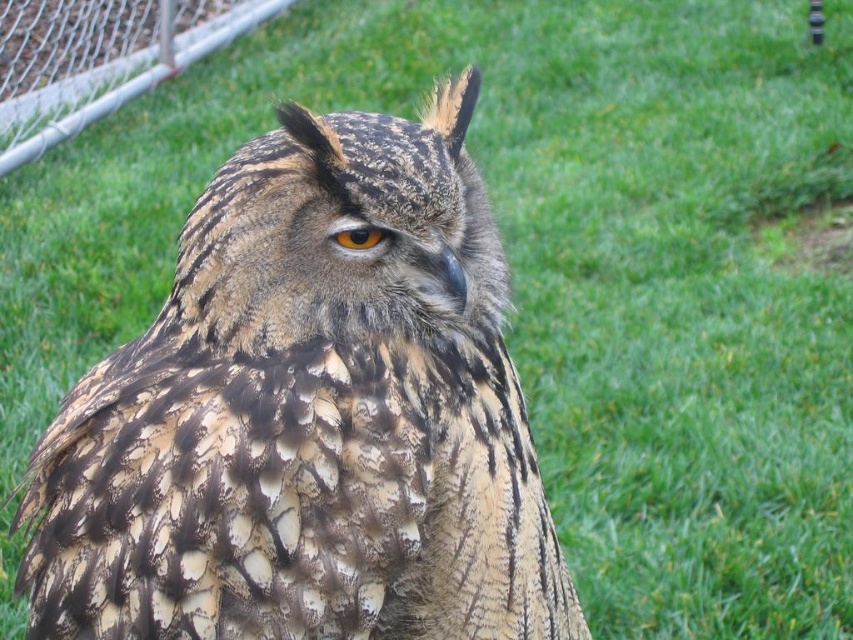
Question: Observing the image, what is the correct spatial positioning of brushed metal fence at upper left in reference to brown textured eye at center?

Choices:
 (A) below
 (B) above

Answer: (B)

Question: Which point appears closest to the camera in this image?

Choices:
 (A) (370, 232)
 (B) (73, 3)

Answer: (A)

Question: Among these points, which one is nearest to the camera?

Choices:
 (A) (164, 452)
 (B) (351, 250)
 (C) (42, 100)

Answer: (A)

Question: Which point appears closest to the camera in this image?

Choices:
 (A) (24, 148)
 (B) (369, 236)

Answer: (B)

Question: Does camouflage feathered owl at center appear under brushed metal fence at upper left?

Choices:
 (A) yes
 (B) no

Answer: (A)

Question: Does camouflage feathered owl at center appear on the right side of brown textured eye at center?

Choices:
 (A) yes
 (B) no

Answer: (B)